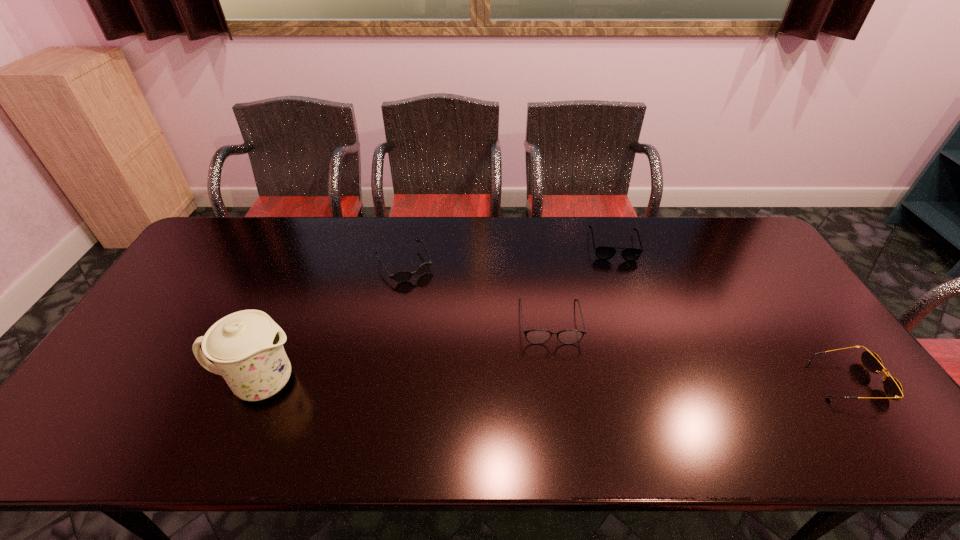
Select which object appears as the closest to the farther spectacles. Please provide its 2D coordinates. Your answer should be formatted as a tuple, i.e. [(x, y)], where the tuple contains the x and y coordinates of a point satisfying the conditions above.

[(537, 336)]

This screenshot has height=540, width=960. Find the location of `the fourth closest object to the farther sunglasses`. the fourth closest object to the farther sunglasses is located at coordinates (893, 389).

Where is `vacant region that satisfies the following two spatial constraints: 1. on the front side of the nearer sunglasses; 2. on the front-facing side of the right spectacles`? Image resolution: width=960 pixels, height=540 pixels. vacant region that satisfies the following two spatial constraints: 1. on the front side of the nearer sunglasses; 2. on the front-facing side of the right spectacles is located at coordinates (661, 381).

The width and height of the screenshot is (960, 540). In order to click on free point that satisfies the following two spatial constraints: 1. on the back side of the left sunglasses; 2. on the right side of the farther spectacles in this screenshot , I will do `click(408, 245)`.